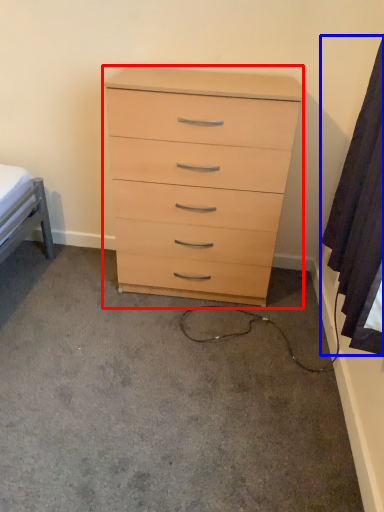
Question: Among these objects, which one is nearest to the camera, chest of drawers (highlighted by a red box) or curtain (highlighted by a blue box)?

Choices:
 (A) chest of drawers
 (B) curtain

Answer: (B)